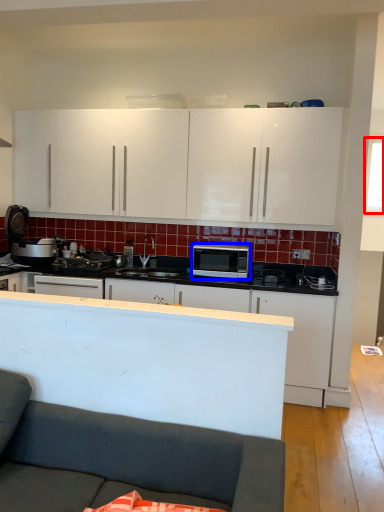
Question: Which object appears closest to the camera in this image, window screen (highlighted by a red box) or microwave oven (highlighted by a blue box)?

Choices:
 (A) window screen
 (B) microwave oven

Answer: (B)